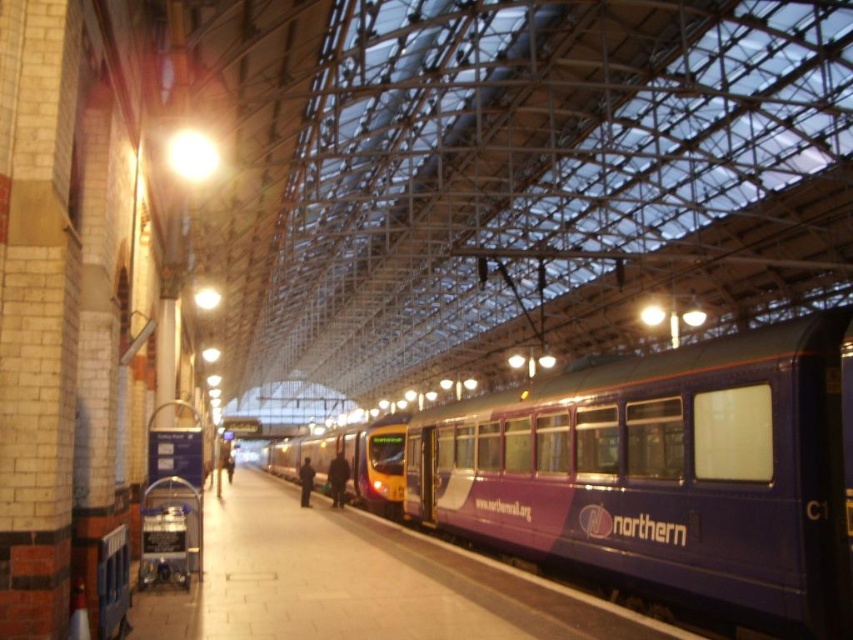
Is dark blue fabric jacket at center behind dark blue jacket at platform center?

Yes, it is behind dark blue jacket at platform center.

Is dark blue fabric jacket at center below dark blue jacket at platform center?

Actually, dark blue fabric jacket at center is above dark blue jacket at platform center.

Find the location of `dark blue fabric jacket at center`. dark blue fabric jacket at center is located at coordinates pyautogui.click(x=337, y=477).

Is purple glossy train at center positioned in front of dark blue jacket at platform center?

Yes, it is.

Does purple glossy train at center have a lesser height compared to dark blue jacket at platform center?

No.

Between point (759, 365) and point (300, 493), which one is positioned in front?

Point (759, 365) is more forward.

In order to click on purple glossy train at center in this screenshot , I will do `click(663, 474)`.

Which is in front, point (799, 636) or point (337, 490)?

Point (799, 636) is in front.

Between purple glossy train at center and dark blue fabric jacket at center, which one appears on the left side from the viewer's perspective?

Positioned to the left is dark blue fabric jacket at center.

Image resolution: width=853 pixels, height=640 pixels. What do you see at coordinates (663, 474) in the screenshot?
I see `purple glossy train at center` at bounding box center [663, 474].

The image size is (853, 640). I want to click on purple glossy train at center, so click(663, 474).